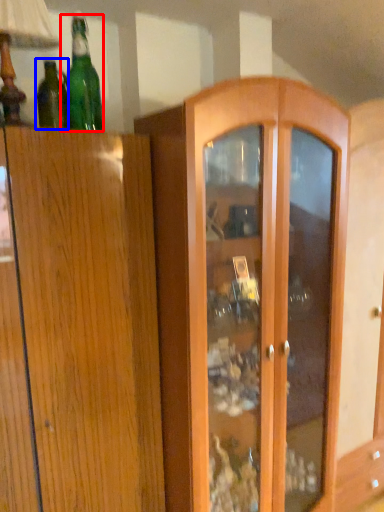
Question: Which point is further to the camera, bottle (highlighted by a red box) or bottle (highlighted by a blue box)?

Choices:
 (A) bottle
 (B) bottle

Answer: (B)